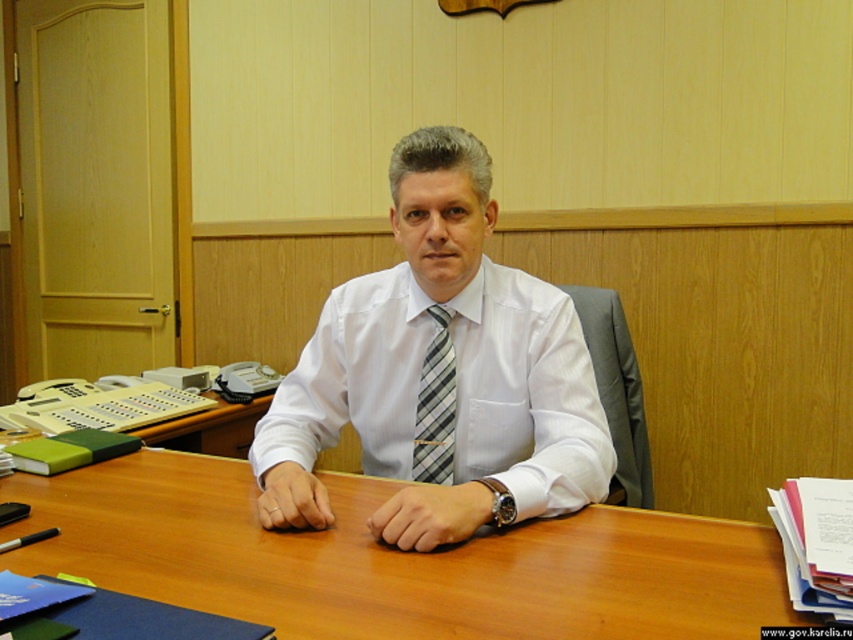
Question: Which object is closer to the camera taking this photo?

Choices:
 (A) wooden at center
 (B) gray striped tie at center
 (C) white striped tie at center

Answer: (A)

Question: Which object is closer to the camera taking this photo?

Choices:
 (A) wooden at center
 (B) gray striped tie at center
 (C) white striped tie at center

Answer: (A)

Question: Which object is closer to the camera taking this photo?

Choices:
 (A) gray striped tie at center
 (B) wooden at center

Answer: (B)

Question: Is white striped tie at center above gray striped tie at center?

Choices:
 (A) no
 (B) yes

Answer: (B)

Question: Does wooden at center have a lesser width compared to white striped tie at center?

Choices:
 (A) no
 (B) yes

Answer: (A)

Question: Can you confirm if white striped tie at center is smaller than gray striped tie at center?

Choices:
 (A) no
 (B) yes

Answer: (A)